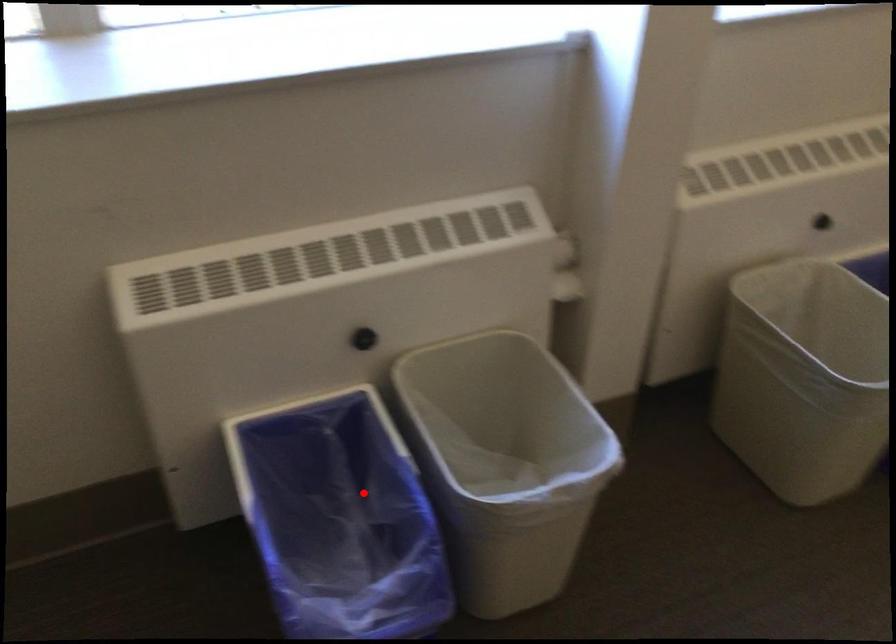
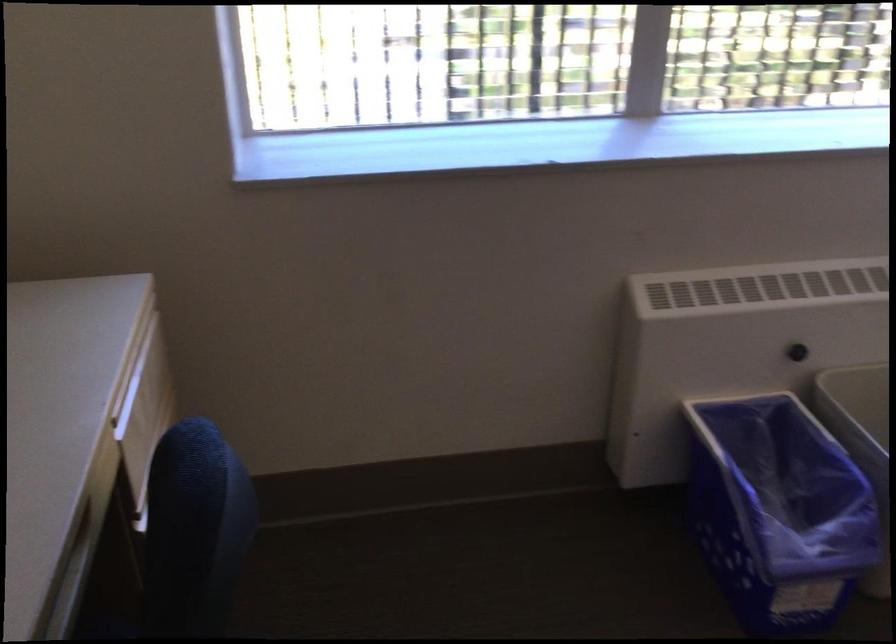
Question: I am providing you with two images of the same scene from different viewpoints. Given a red point in image1, look at the same physical point in image2. Is it:

Choices:
 (A) Closer to the viewpoint
 (B) Farther from the viewpoint

Answer: (B)